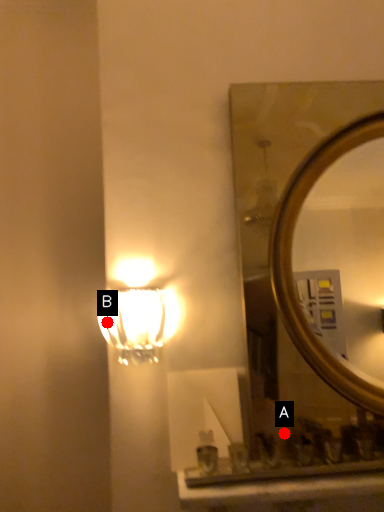
Question: Two points are circled on the image, labeled by A and B beside each circle. Among these points, which one is nearest to the camera?

Choices:
 (A) A is closer
 (B) B is closer

Answer: (A)